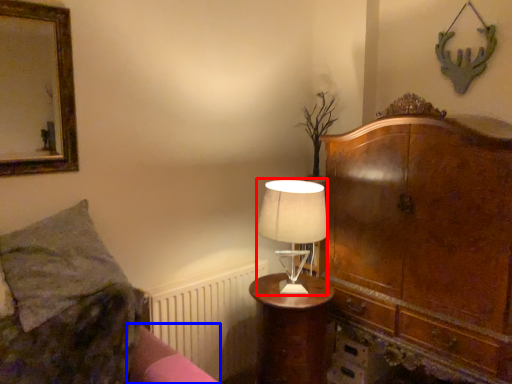
Question: Which object is further to the camera taking this photo, table lamp (highlighted by a red box) or bed frame (highlighted by a blue box)?

Choices:
 (A) table lamp
 (B) bed frame

Answer: (A)